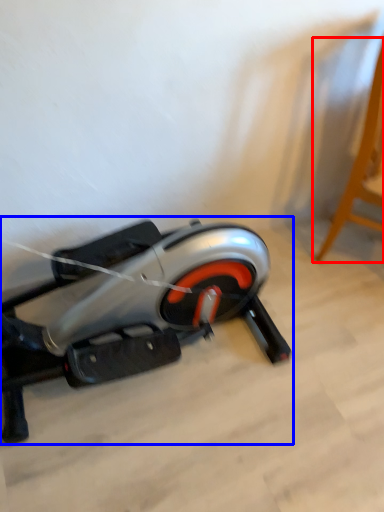
Question: Which object is further to the camera taking this photo, furniture (highlighted by a red box) or stationary bicycle (highlighted by a blue box)?

Choices:
 (A) furniture
 (B) stationary bicycle

Answer: (A)